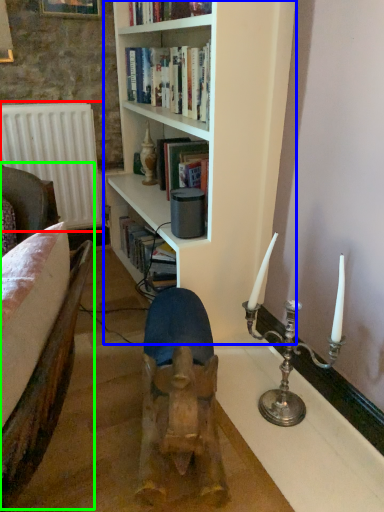
Question: Estimate the real-world distances between objects in this image. Which object is closer to radiator (highlighted by a red box), bookcase (highlighted by a blue box) or armchair (highlighted by a green box)?

Choices:
 (A) bookcase
 (B) armchair

Answer: (A)